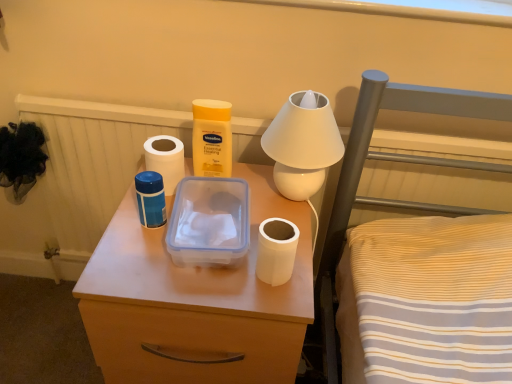
The width and height of the screenshot is (512, 384). I want to click on unoccupied area behind white matte toilet paper at center, which is the second toilet paper from top to bottom, so click(x=270, y=214).